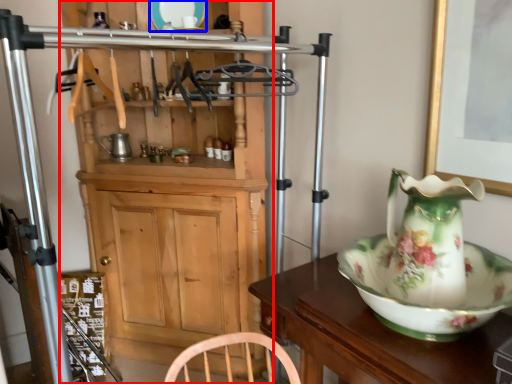
Question: Which of the following is the farthest to the observer, cabinetry (highlighted by a red box) or plate (highlighted by a blue box)?

Choices:
 (A) cabinetry
 (B) plate

Answer: (B)